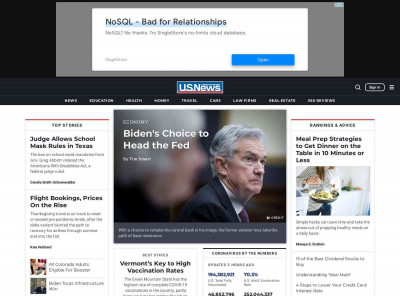
At what (x,y) coordinates should I click in order to perform the action: click on bowl. Please return your answer as a coordinate pair (x, y). The image size is (400, 296). Looking at the image, I should click on (322, 197).